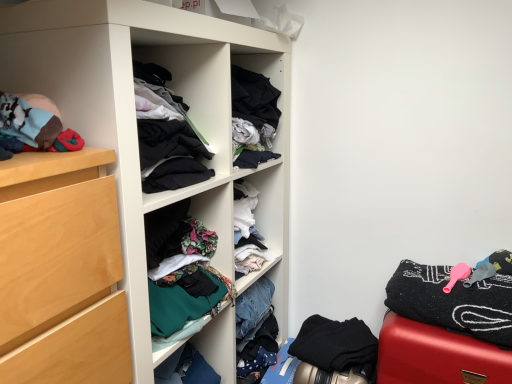
This screenshot has width=512, height=384. What do you see at coordinates (453, 302) in the screenshot?
I see `black textured towel at right, which ranks as the 2th clothing in bottom-to-top order` at bounding box center [453, 302].

The height and width of the screenshot is (384, 512). What are the coordinates of `black textured towel at right, which ranks as the 2th clothing in bottom-to-top order` in the screenshot? It's located at (453, 302).

I want to click on matte white cupboard at center, so click(x=135, y=114).

Where is `smooth red suitcase at lower right`? smooth red suitcase at lower right is located at coordinates (437, 356).

What's the angular difference between smooth red suitcase at lower right and black textured towel at right, which ranks as the 2th clothing in bottom-to-top order,'s facing directions?

The angle between the facing direction of smooth red suitcase at lower right and the facing direction of black textured towel at right, which ranks as the 2th clothing in bottom-to-top order, is 0.0022 degrees.

Is smooth red suitcase at lower right completely or partially outside of black textured towel at right, placed as the 1th clothing when sorted from top to bottom?

Indeed, smooth red suitcase at lower right is completely outside black textured towel at right, placed as the 1th clothing when sorted from top to bottom.

Considering the relative positions of smooth red suitcase at lower right and black textured towel at right, placed as the 1th clothing when sorted from top to bottom, in the image provided, is smooth red suitcase at lower right to the left or to the right of black textured towel at right, placed as the 1th clothing when sorted from top to bottom,?

smooth red suitcase at lower right is positioned on black textured towel at right, placed as the 1th clothing when sorted from top to bottom,'s right side.

Consider the image. From the image's perspective, would you say smooth red suitcase at lower right is shown under black textured towel at right, which ranks as the 2th clothing in bottom-to-top order?

Yes, from the image's perspective, smooth red suitcase at lower right is below black textured towel at right, which ranks as the 2th clothing in bottom-to-top order.

From the image's perspective, is black textured towel at right, placed as the 1th clothing when sorted from top to bottom, on smooth red suitcase at lower right?

Correct, black textured towel at right, placed as the 1th clothing when sorted from top to bottom, appears higher than smooth red suitcase at lower right in the image.

Which of these two, black textured towel at right, which ranks as the 2th clothing in bottom-to-top order, or smooth red suitcase at lower right, is wider?

Wider between the two is smooth red suitcase at lower right.

From a real-world perspective, is black textured towel at right, which ranks as the 2th clothing in bottom-to-top order, located higher than smooth red suitcase at lower right?

Yes.

Could smooth red suitcase at lower right be considered to be inside matte white cupboard at center?

No, smooth red suitcase at lower right is not surrounded by matte white cupboard at center.

Considering the positions of objects matte white cupboard at center and smooth red suitcase at lower right in the image provided, who is more to the right, matte white cupboard at center or smooth red suitcase at lower right?

From the viewer's perspective, smooth red suitcase at lower right appears more on the right side.

Is there a large distance between matte white cupboard at center and smooth red suitcase at lower right?

matte white cupboard at center is actually quite close to smooth red suitcase at lower right.

Between matte white cupboard at center and black textured towel at right, placed as the 1th clothing when sorted from top to bottom, which one has more height?

Standing taller between the two is matte white cupboard at center.

From a real-world perspective, is matte white cupboard at center on top of black textured towel at right, placed as the 1th clothing when sorted from top to bottom?

No.

From the image's perspective, between matte white cupboard at center and black textured towel at right, which ranks as the 2th clothing in bottom-to-top order, who is located below?

matte white cupboard at center.

How far apart are matte white cupboard at center and black textured towel at right, placed as the 1th clothing when sorted from top to bottom?

A distance of 25.52 inches exists between matte white cupboard at center and black textured towel at right, placed as the 1th clothing when sorted from top to bottom.

Considering the sizes of objects black matte fabric at lower right, which is the first clothing in bottom-to-top order, and smooth red suitcase at lower right in the image provided, who is bigger, black matte fabric at lower right, which is the first clothing in bottom-to-top order, or smooth red suitcase at lower right?

smooth red suitcase at lower right.

From their relative heights in the image, would you say black matte fabric at lower right, which is the first clothing in bottom-to-top order, is taller or shorter than smooth red suitcase at lower right?

In the image, black matte fabric at lower right, which is the first clothing in bottom-to-top order, appears to be shorter than smooth red suitcase at lower right.

Is black matte fabric at lower right, which is the first clothing in bottom-to-top order, next to smooth red suitcase at lower right?

They are not placed beside each other.

Locate an element on the screen. This screenshot has width=512, height=384. cupboard below the black textured towel at right, which ranks as the 2th clothing in bottom-to-top order (from a real-world perspective) is located at coordinates (135, 114).

Is black textured towel at right, placed as the 1th clothing when sorted from top to bottom, turned away from matte white cupboard at center?

No, black textured towel at right, placed as the 1th clothing when sorted from top to bottom, is not facing away from matte white cupboard at center.

From the image's perspective, who appears lower, black textured towel at right, placed as the 1th clothing when sorted from top to bottom, or matte white cupboard at center?

matte white cupboard at center appears lower in the image.

Between black textured towel at right, placed as the 1th clothing when sorted from top to bottom, and matte white cupboard at center, which one has larger width?

With larger width is matte white cupboard at center.

Is black textured towel at right, which ranks as the 2th clothing in bottom-to-top order, taller or shorter than black matte fabric at lower right, which is the first clothing in bottom-to-top order?

Considering their sizes, black textured towel at right, which ranks as the 2th clothing in bottom-to-top order, has less height than black matte fabric at lower right, which is the first clothing in bottom-to-top order.

Is point (424, 271) behind point (315, 332)?

No, it is in front of (315, 332).

Is black textured towel at right, placed as the 1th clothing when sorted from top to bottom, thinner than black matte fabric at lower right, arranged as the second clothing when viewed from the top?

Yes, black textured towel at right, placed as the 1th clothing when sorted from top to bottom, is thinner than black matte fabric at lower right, arranged as the second clothing when viewed from the top.

Is black textured towel at right, which ranks as the 2th clothing in bottom-to-top order, with black matte fabric at lower right, which is the first clothing in bottom-to-top order?

No, black textured towel at right, which ranks as the 2th clothing in bottom-to-top order, is not in contact with black matte fabric at lower right, which is the first clothing in bottom-to-top order.

The height and width of the screenshot is (384, 512). Identify the location of clothing above the smooth red suitcase at lower right (from a real-world perspective). (453, 302).

At what (x,y) coordinates should I click in order to perform the action: click on clothing above the smooth red suitcase at lower right (from the image's perspective). Please return your answer as a coordinate pair (x, y). Looking at the image, I should click on (453, 302).

Considering their positions, is matte white cupboard at center positioned further to smooth red suitcase at lower right than black matte fabric at lower right, which is the first clothing in bottom-to-top order?

matte white cupboard at center is positioned further to the anchor smooth red suitcase at lower right.

From the image, which object appears to be nearer to black matte fabric at lower right, which is the first clothing in bottom-to-top order, matte white cupboard at center or smooth red suitcase at lower right?

The object closer to black matte fabric at lower right, which is the first clothing in bottom-to-top order, is smooth red suitcase at lower right.

From the image, which object appears to be farther from black matte fabric at lower right, which is the first clothing in bottom-to-top order, matte white cupboard at center or black textured towel at right, placed as the 1th clothing when sorted from top to bottom?

matte white cupboard at center.

Looking at the image, which one is located further to smooth red suitcase at lower right, black matte fabric at lower right, arranged as the second clothing when viewed from the top, or black textured towel at right, which ranks as the 2th clothing in bottom-to-top order?

black matte fabric at lower right, arranged as the second clothing when viewed from the top, lies further to smooth red suitcase at lower right than the other object.

Considering their positions, is black textured towel at right, placed as the 1th clothing when sorted from top to bottom, positioned closer to matte white cupboard at center than smooth red suitcase at lower right?

Among the two, black textured towel at right, placed as the 1th clothing when sorted from top to bottom, is located nearer to matte white cupboard at center.

In the scene shown: Considering their positions, is black textured towel at right, which ranks as the 2th clothing in bottom-to-top order, positioned closer to black matte fabric at lower right, which is the first clothing in bottom-to-top order, than smooth red suitcase at lower right?

The object closer to black matte fabric at lower right, which is the first clothing in bottom-to-top order, is smooth red suitcase at lower right.

Looking at the image, which one is located further to smooth red suitcase at lower right, matte white cupboard at center or black textured towel at right, placed as the 1th clothing when sorted from top to bottom?

Among the two, matte white cupboard at center is located further to smooth red suitcase at lower right.

Estimate the real-world distances between objects in this image. Which object is closer to matte white cupboard at center, smooth red suitcase at lower right or black matte fabric at lower right, which is the first clothing in bottom-to-top order?

black matte fabric at lower right, which is the first clothing in bottom-to-top order, is closer to matte white cupboard at center.

The image size is (512, 384). Find the location of `clothing located between matte white cupboard at center and black textured towel at right, which ranks as the 2th clothing in bottom-to-top order, in the left-right direction`. clothing located between matte white cupboard at center and black textured towel at right, which ranks as the 2th clothing in bottom-to-top order, in the left-right direction is located at coordinates (337, 346).

This screenshot has width=512, height=384. I want to click on furniture between black textured towel at right, which ranks as the 2th clothing in bottom-to-top order, and black matte fabric at lower right, which is the first clothing in bottom-to-top order, vertically, so click(x=437, y=356).